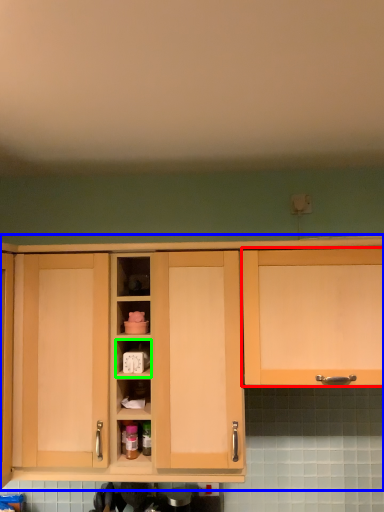
Question: Considering the real-world distances, which object is farthest from cabinetry (highlighted by a red box)? cabinetry (highlighted by a blue box) or cabinet (highlighted by a green box)?

Choices:
 (A) cabinetry
 (B) cabinet

Answer: (B)